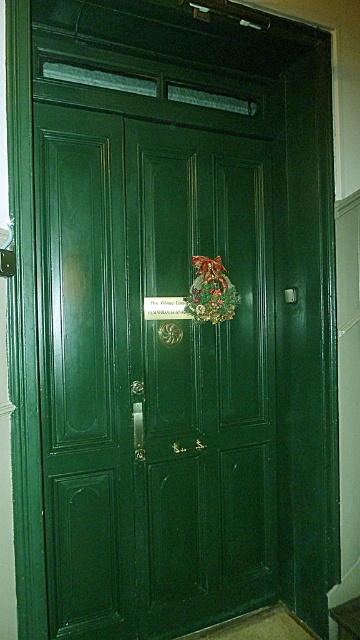
Who is more distant from viewer, [72,474] or [214,301]?

Point [214,301]

In the scene shown: Measure the distance between green polished wood door at center and green fabric wreath at center.

They are 36.68 centimeters apart.

Between point (176, 483) and point (227, 291), which one is positioned in front?

Positioned in front is point (176, 483).

Image resolution: width=360 pixels, height=640 pixels. What are the coordinates of `green polished wood door at center` in the screenshot? It's located at (153, 368).